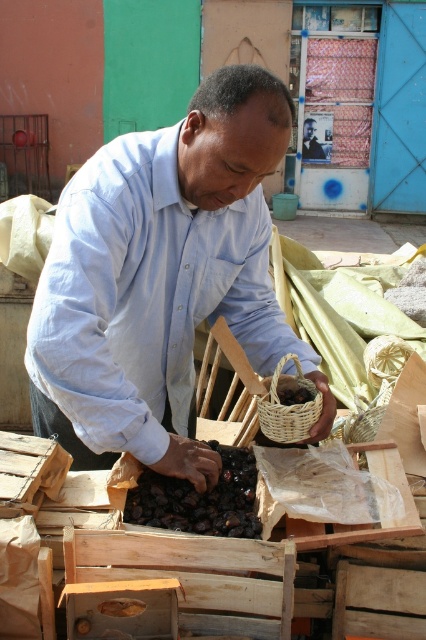
You are a customer at the market and want to buy some dates. You see the dark brown dried fruit at center and the woven brown basket at center. Which one is located to the left of the other?

The dark brown dried fruit at center is positioned on the left side of woven brown basket at center.

You are a customer at the market and want to buy the dark brown dried fruit at center. The vendor is standing 1 meter away from you. If you walk straight towards the fruit, will you reach it before the vendor?

The dark brown dried fruit at center is at point (199, 499). Since the vendor is already handling the fruit, you would need to wait for them to finish before approaching. However, based on the coordinates alone, the vendor is closer to the fruit as they are directly interacting with it, so they would reach it first.